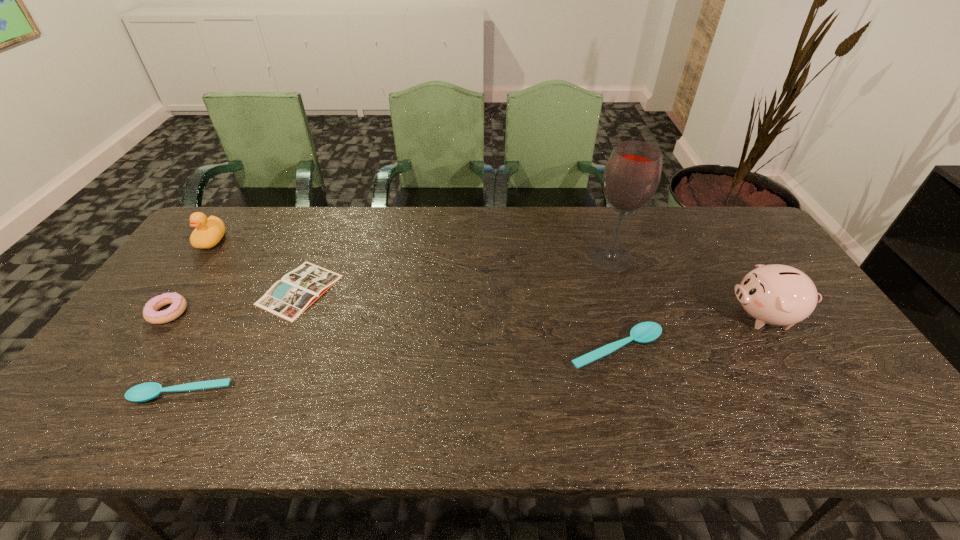
This screenshot has height=540, width=960. In order to click on vacant point located between the tallest object and the third tallest object in this screenshot , I will do pyautogui.click(x=411, y=249).

At what (x,y) coordinates should I click in order to perform the action: click on free area in between the third shortest object and the duck. Please return your answer as a coordinate pair (x, y). This screenshot has height=540, width=960. Looking at the image, I should click on (414, 295).

Where is `free space between the second shortest object and the alcohol`? The width and height of the screenshot is (960, 540). free space between the second shortest object and the alcohol is located at coordinates (396, 326).

You are a GUI agent. You are given a task and a screenshot of the screen. Output one action in this format:
    pyautogui.click(x=<x>, y=<y>)
    Task: Click on the vacant space that is in between the piggy bank and the doughnut
    
    Given the screenshot: What is the action you would take?
    pyautogui.click(x=467, y=314)

The width and height of the screenshot is (960, 540). I want to click on empty location between the fifth shortest object and the shortest object, so click(x=255, y=265).

This screenshot has width=960, height=540. In order to click on unoccupied area between the third tallest object and the alcohol in this screenshot , I will do `click(411, 249)`.

This screenshot has height=540, width=960. I want to click on vacant area that lies between the third shortest object and the alcohol, so coord(613,303).

Where is `vacant area that lies between the nearest object and the fourth tallest object`? Image resolution: width=960 pixels, height=540 pixels. vacant area that lies between the nearest object and the fourth tallest object is located at coordinates (175, 353).

The image size is (960, 540). What are the coordinates of `object that is the closest to the alcohol` in the screenshot? It's located at (644, 332).

Image resolution: width=960 pixels, height=540 pixels. Identify the location of object that stands as the third closest to the piggy bank. (288, 298).